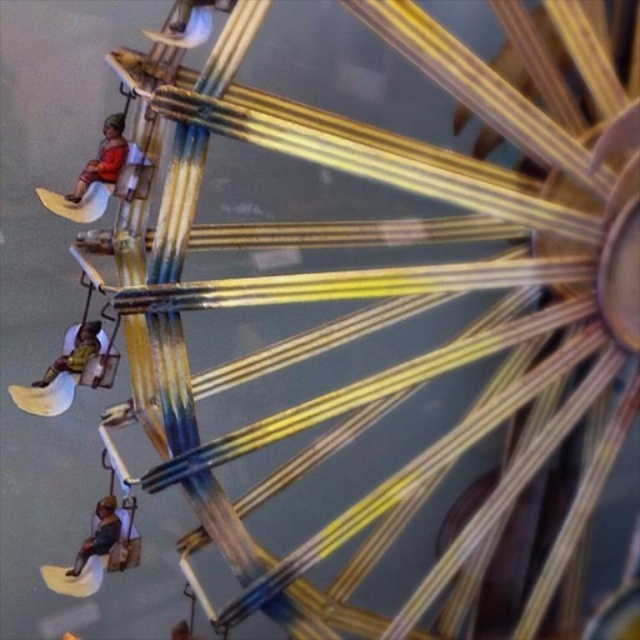
Is point (125, 147) closer to viewer compared to point (97, 332)?

Yes, it is.

This screenshot has height=640, width=640. What are the coordinates of `matte orange fabric at upper left` in the screenshot? It's located at coord(104,157).

The height and width of the screenshot is (640, 640). I want to click on matte orange fabric at upper left, so click(104, 157).

Locate an element on the screen. The width and height of the screenshot is (640, 640). matte orange fabric at upper left is located at coordinates (104, 157).

Is point (109, 154) positioned in front of point (115, 518)?

Yes, point (109, 154) is closer to viewer.

Does point (109, 163) lie behind point (106, 516)?

No, it is not.

Who is more distant from viewer, (x=125, y=148) or (x=113, y=541)?

The point (x=113, y=541) is behind.

The image size is (640, 640). In order to click on matte orange fabric at upper left in this screenshot , I will do `click(104, 157)`.

Does dark brown wooden figure at lower left appear under green fabric at lower left?

Yes.

Which is behind, point (84, 557) or point (42, 380)?

Positioned behind is point (42, 380).

Is point (99, 525) farther from viewer compared to point (76, 332)?

No.

Find the location of a particular element. dark brown wooden figure at lower left is located at coordinates (99, 534).